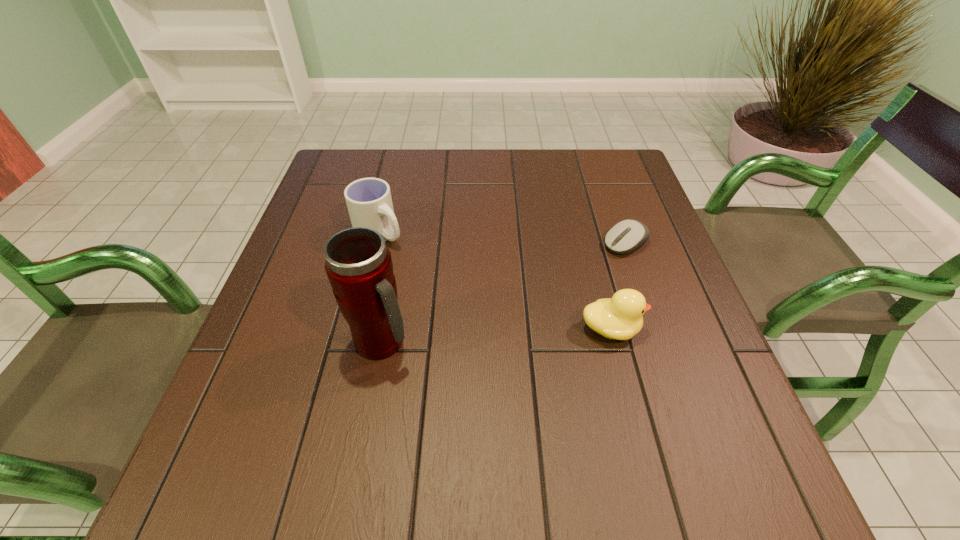
In order to click on unoccupied area between the duckling and the third shortest object in this screenshot , I will do `click(495, 281)`.

This screenshot has width=960, height=540. I want to click on free space between the computer equipment and the duckling, so click(618, 286).

Find the location of a particular element. This screenshot has width=960, height=540. vacant area that lies between the cup and the shortest object is located at coordinates (503, 238).

The width and height of the screenshot is (960, 540). I want to click on vacant space that is in between the computer equipment and the third shortest object, so click(x=503, y=238).

Identify the location of empty space between the computer equipment and the tallest object. (504, 293).

Image resolution: width=960 pixels, height=540 pixels. What are the coordinates of `free spot between the duckling and the computer equipment` in the screenshot? It's located at (618, 286).

At what (x,y) coordinates should I click in order to perform the action: click on free space between the computer equipment and the second shortest object. Please return your answer as a coordinate pair (x, y). The width and height of the screenshot is (960, 540). Looking at the image, I should click on (618, 286).

Identify the location of empty space between the duckling and the tallest object. The height and width of the screenshot is (540, 960). (496, 335).

Where is `object that ranks as the closest to the cup`? Image resolution: width=960 pixels, height=540 pixels. object that ranks as the closest to the cup is located at coordinates (358, 263).

Point out which object is positioned as the second nearest to the duckling. Please provide its 2D coordinates. Your answer should be formatted as a tuple, i.e. [(x, y)], where the tuple contains the x and y coordinates of a point satisfying the conditions above.

[(358, 263)]